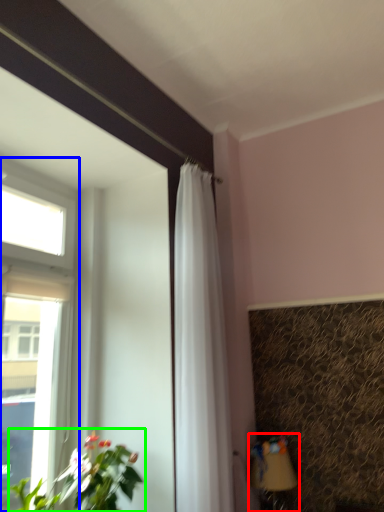
Question: Which is nearer to the table lamp (highlighted by a red box)? window (highlighted by a blue box) or houseplant (highlighted by a green box).

Choices:
 (A) window
 (B) houseplant

Answer: (B)